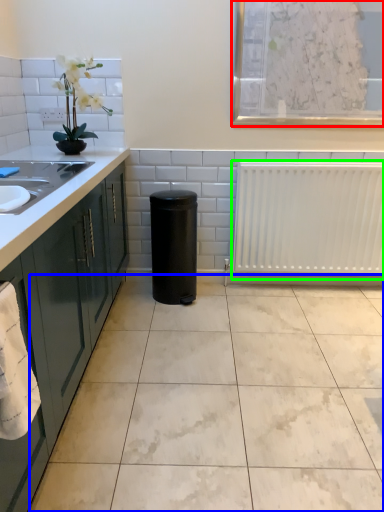
Question: Estimate the real-world distances between objects in this image. Which object is closer to window screen (highlighted by a red box), ceramic tile (highlighted by a blue box) or radiator (highlighted by a green box)?

Choices:
 (A) ceramic tile
 (B) radiator

Answer: (B)